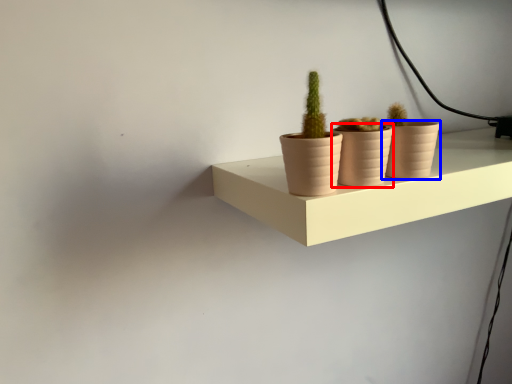
Question: Which of the following is the farthest to the observer, flowerpot (highlighted by a red box) or flowerpot (highlighted by a blue box)?

Choices:
 (A) flowerpot
 (B) flowerpot

Answer: (B)